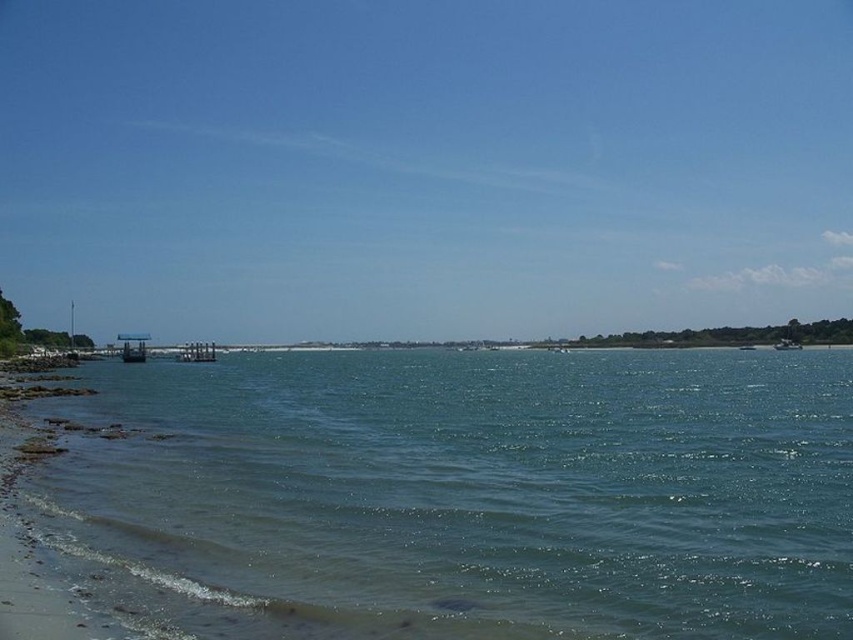
Which of these two, metallic gray dock at center or metallic silver boat at right, stands shorter?

Standing shorter between the two is metallic silver boat at right.

Is point (207, 342) more distant than point (784, 346)?

Yes.

Find the location of a particular element. This screenshot has height=640, width=853. metallic gray dock at center is located at coordinates (196, 353).

At what (x,y) coordinates should I click in order to perform the action: click on clear blue water at lower left. Please return your answer as a coordinate pair (x, y). The height and width of the screenshot is (640, 853). Looking at the image, I should click on coord(461,496).

Looking at this image, who is more distant from viewer, (173, 412) or (776, 346)?

The point (776, 346) is more distant.

Does point (248, 596) lie behind point (792, 340)?

No, it is not.

You are a GUI agent. You are given a task and a screenshot of the screen. Output one action in this format:
    pyautogui.click(x=<x>, y=<y>)
    Task: Click on the clear blue water at lower left
    The image size is (853, 640).
    Given the screenshot: What is the action you would take?
    pyautogui.click(x=461, y=496)

Does point (602, 564) come behind point (204, 358)?

No, (602, 564) is in front of (204, 358).

Is point (244, 602) positioned in front of point (195, 362)?

Yes, point (244, 602) is closer to viewer.

At what (x,y) coordinates should I click in order to perform the action: click on clear blue water at lower left. Please return your answer as a coordinate pair (x, y). Looking at the image, I should click on point(461,496).